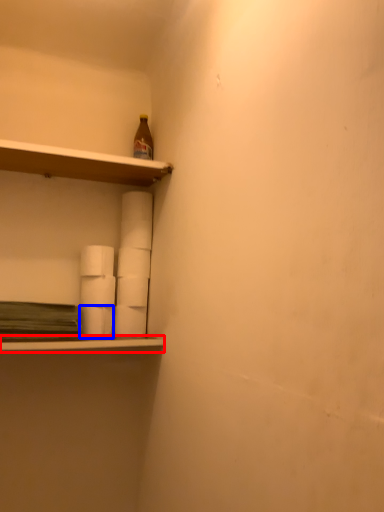
Question: Which of the following is the farthest to the observer, ledge (highlighted by a red box) or paper towel (highlighted by a blue box)?

Choices:
 (A) ledge
 (B) paper towel

Answer: (B)